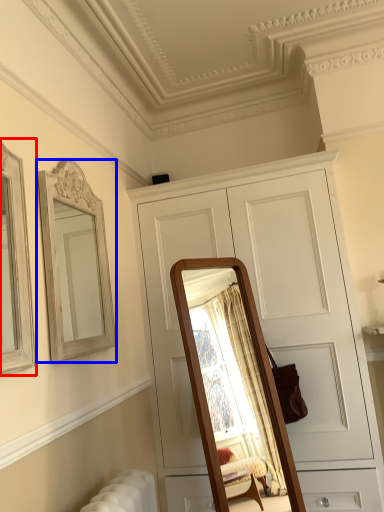
Question: Which object appears closest to the camera in this image, picture frame (highlighted by a red box) or mirror (highlighted by a blue box)?

Choices:
 (A) picture frame
 (B) mirror

Answer: (A)